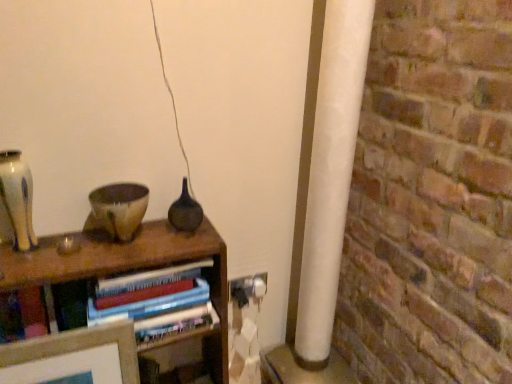
Question: From a real-world perspective, is matte beige vase at left, arranged as the first glass vase when viewed from the left, physically above hardcover books at center?

Choices:
 (A) no
 (B) yes

Answer: (B)

Question: Can you confirm if matte beige vase at left, positioned as the second glass vase in back-to-front order, is taller than hardcover books at center?

Choices:
 (A) yes
 (B) no

Answer: (B)

Question: Are matte beige vase at left, positioned as the second glass vase in back-to-front order, and hardcover books at center making contact?

Choices:
 (A) no
 (B) yes

Answer: (A)

Question: Is matte beige vase at left, the 1th glass vase viewed from the front, positioned with its back to hardcover books at center?

Choices:
 (A) no
 (B) yes

Answer: (A)

Question: Is matte beige vase at left, arranged as the first glass vase when viewed from the left, facing towards hardcover books at center?

Choices:
 (A) yes
 (B) no

Answer: (B)

Question: From the image's perspective, is hardcover books at center above or below white plastic electric outlet at lower right?

Choices:
 (A) above
 (B) below

Answer: (B)

Question: Is hardcover books at center inside the boundaries of white plastic electric outlet at lower right, or outside?

Choices:
 (A) outside
 (B) inside

Answer: (A)

Question: Relative to white plastic electric outlet at lower right, is hardcover books at center in front or behind?

Choices:
 (A) front
 (B) behind

Answer: (A)

Question: Is hardcover books at center wider or thinner than white plastic electric outlet at lower right?

Choices:
 (A) wide
 (B) thin

Answer: (A)

Question: From a real-world perspective, is speckled ceramic bowl at center positioned above or below white plastic electric outlet at lower right?

Choices:
 (A) below
 (B) above

Answer: (B)

Question: From their relative heights in the image, would you say speckled ceramic bowl at center is taller or shorter than white plastic electric outlet at lower right?

Choices:
 (A) short
 (B) tall

Answer: (B)

Question: Would you say speckled ceramic bowl at center is inside or outside white plastic electric outlet at lower right?

Choices:
 (A) outside
 (B) inside

Answer: (A)

Question: Is point (139, 185) positioned closer to the camera than point (228, 286)?

Choices:
 (A) farther
 (B) closer

Answer: (B)

Question: Is hardcover books at center bigger or smaller than speckled ceramic bowl at center?

Choices:
 (A) big
 (B) small

Answer: (A)

Question: Is hardcover books at center wider or thinner than speckled ceramic bowl at center?

Choices:
 (A) wide
 (B) thin

Answer: (A)